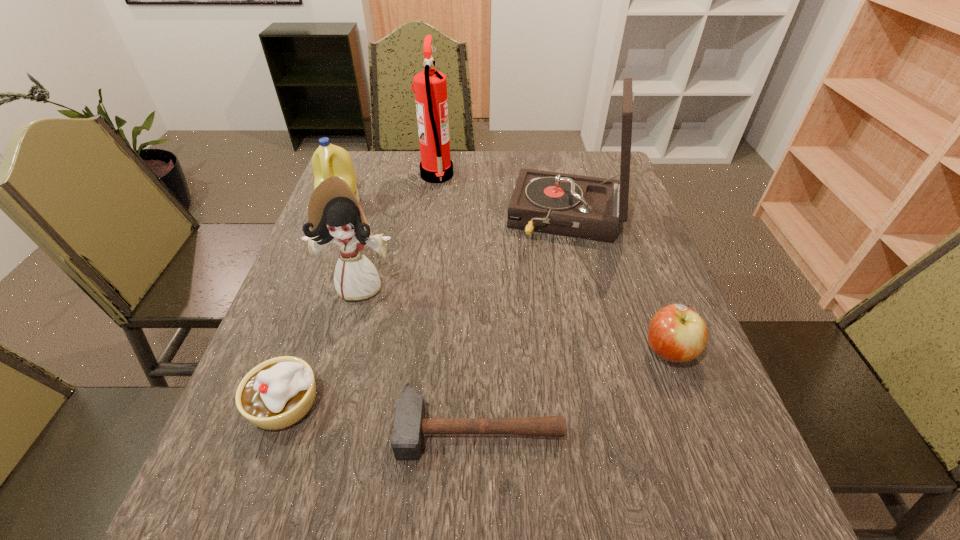
This screenshot has height=540, width=960. In order to click on free spot that satisfies the following two spatial constraints: 1. on the front side of the apple; 2. on the left side of the phonograph record in this screenshot , I will do `click(599, 351)`.